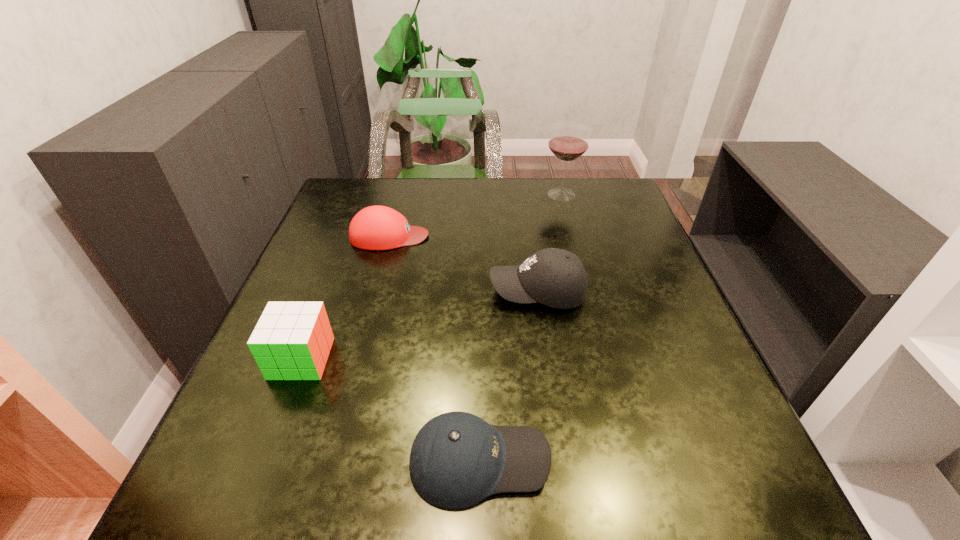
Where is `object located at the far right corner`? The image size is (960, 540). object located at the far right corner is located at coordinates (568, 141).

The image size is (960, 540). I want to click on vacant space at the far edge, so click(x=407, y=189).

In the image, there is a desktop. Identify the location of vacant space at the near edge. Image resolution: width=960 pixels, height=540 pixels. (350, 510).

Identify the location of free space at the left edge of the desktop. This screenshot has height=540, width=960. (241, 402).

This screenshot has width=960, height=540. In the image, there is a desktop. Identify the location of vacant space at the right edge. (660, 356).

This screenshot has width=960, height=540. I want to click on free space at the far right corner of the desktop, so click(640, 220).

I want to click on unoccupied position between the farthest object and the nearest object, so click(520, 327).

Locate an element on the screen. Image resolution: width=960 pixels, height=540 pixels. empty space that is in between the fourth farthest object and the farthest baseball cap is located at coordinates (346, 297).

Locate an element on the screen. unoccupied position between the second nearest object and the tallest object is located at coordinates (431, 276).

Find the location of a particular element. This screenshot has width=960, height=540. unoccupied area between the fourth farthest object and the wineglass is located at coordinates (431, 276).